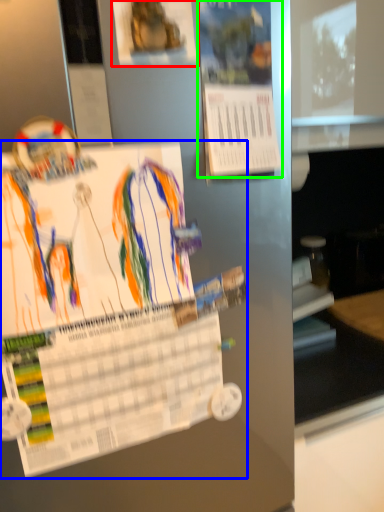
Question: Which is farther away from poster (highlighted by a red box)? poster (highlighted by a blue box) or poster (highlighted by a green box)?

Choices:
 (A) poster
 (B) poster

Answer: (A)